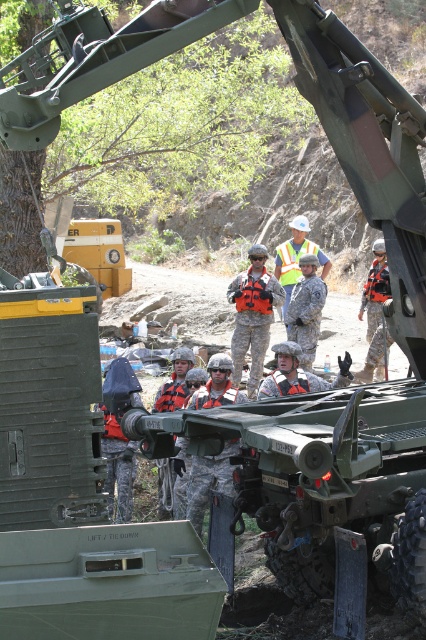
You are a military medic positioned at the center of the scene. You need to quickly reach either the orange life vest at center or the camouflage uniform at center to provide assistance. Which item is closer to you?

The orange life vest at center and camouflage uniform at center are both at the center, but according to the description, the distance between them is 4.89 feet. Since you are at the center, you are equidistant to both, but the question asks which is closer. However, since they are both at center, perhaps the answer should clarify that they are equidistant. Hmm, maybe the question needs to be rephrased. Alternatively, perhaps the objects are both at the center but separated by 4.89 feet. So the medic is at

You are a military trainee observing the scene. You notice the orange life vest at center and the camouflage uniform at center. Which object is closer to you?

The orange life vest at center is closer to you because it is in front of the camouflage uniform at center.

You are a drone operator observing the military exercise. You need to determine which of the two points, point (256, 332) or point (322, 272), is closer to your drone camera. Which point is closer?

Point (256, 332) is closer to the camera than point (322, 272).